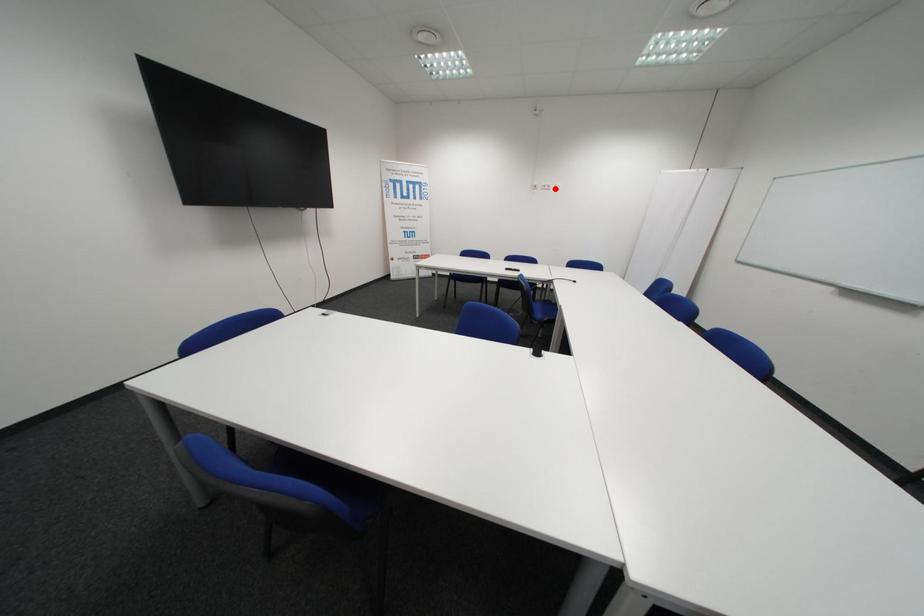
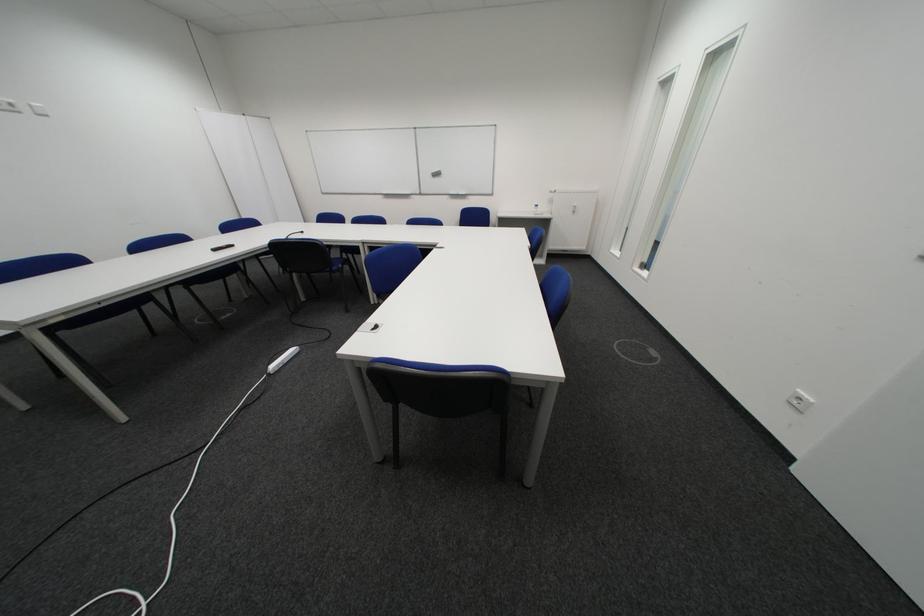
Locate, in the second image, the point that corresponds to the highlighted location in the first image.

(8, 108)